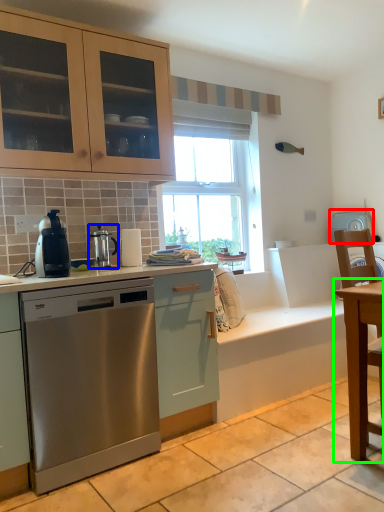
Question: Considering the real-world distances, which object is farthest from appliance (highlighted by a red box)? kitchen appliance (highlighted by a blue box) or table (highlighted by a green box)?

Choices:
 (A) kitchen appliance
 (B) table

Answer: (A)